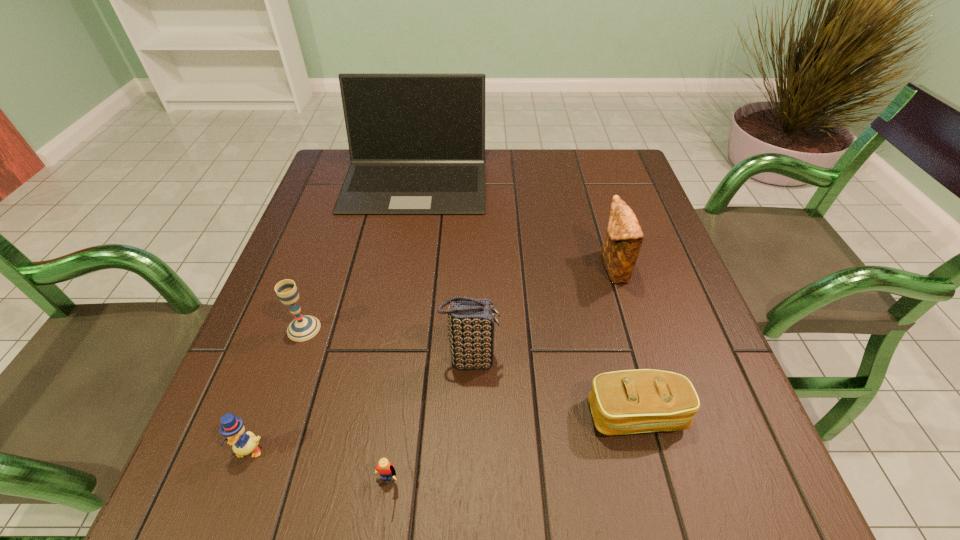
Locate an element on the screen. This screenshot has width=960, height=540. Lego situated at the near edge is located at coordinates (385, 469).

Where is `laptop that is at the left edge`? laptop that is at the left edge is located at coordinates (416, 141).

At what (x,y) coordinates should I click in order to perform the action: click on chalice positioned at the left edge. Please return your answer as a coordinate pair (x, y). The image size is (960, 540). Looking at the image, I should click on (302, 328).

This screenshot has height=540, width=960. In order to click on duckling located at the left edge in this screenshot , I will do [x=232, y=427].

Where is `object that is at the far left corner`? This screenshot has width=960, height=540. object that is at the far left corner is located at coordinates point(416,141).

Locate an element on the screen. Image resolution: width=960 pixels, height=540 pixels. object positioned at the near left corner is located at coordinates [x=232, y=427].

The height and width of the screenshot is (540, 960). I want to click on free space at the far edge of the desktop, so click(x=495, y=159).

Where is `vacant space at the near edge`? Image resolution: width=960 pixels, height=540 pixels. vacant space at the near edge is located at coordinates (546, 502).

In the image, there is a desktop. Identify the location of vacant space at the left edge. (323, 199).

At what (x,y) coordinates should I click in order to perform the action: click on free spot at the right edge of the desktop. Please return your answer as a coordinate pair (x, y). The width and height of the screenshot is (960, 540). Looking at the image, I should click on (735, 417).